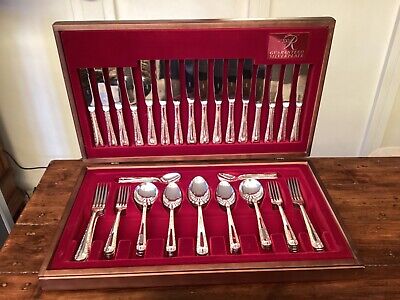
This screenshot has width=400, height=300. In order to click on spoon handles in this screenshot , I will do `click(143, 228)`, `click(170, 237)`, `click(202, 232)`, `click(234, 234)`, `click(265, 230)`, `click(266, 176)`, `click(127, 180)`.